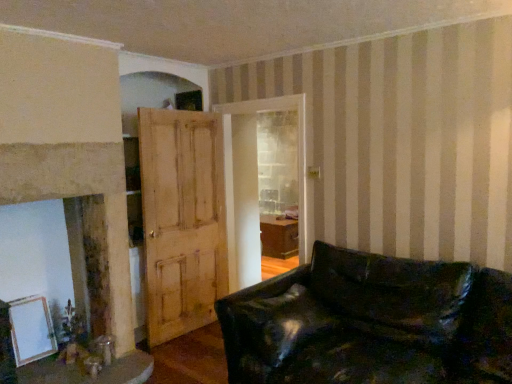
Question: Relative to white matte picture frame at lower left, is light brown wooden door at center in front or behind?

Choices:
 (A) front
 (B) behind

Answer: (B)

Question: From the image's perspective, relative to white matte picture frame at lower left, is light brown wooden door at center above or below?

Choices:
 (A) above
 (B) below

Answer: (A)

Question: Considering the real-world distances, which object is farthest from the smooth beige fireplace at left?

Choices:
 (A) white matte picture frame at lower left
 (B) black leather couch at lower right
 (C) light brown wooden door at center
 (D) wooden table at lower left

Answer: (B)

Question: Estimate the real-world distances between objects in this image. Which object is closer to the wooden table at lower left?

Choices:
 (A) light brown wooden door at center
 (B) white matte picture frame at lower left
 (C) smooth beige fireplace at left
 (D) black leather couch at lower right

Answer: (B)